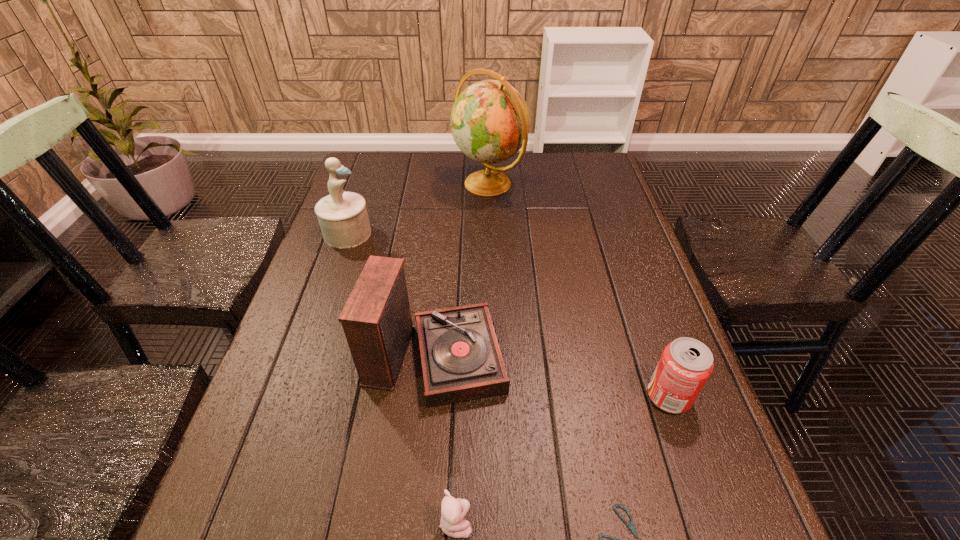
This screenshot has width=960, height=540. What are the coordinates of `vacant area located on the left of the soda can` in the screenshot? It's located at (542, 396).

I want to click on object at the far edge, so click(x=490, y=121).

The width and height of the screenshot is (960, 540). Identify the location of object located at the left edge. coord(343,218).

This screenshot has width=960, height=540. I want to click on object that is at the right edge, so click(x=686, y=364).

I want to click on free space at the far edge of the desktop, so click(562, 187).

This screenshot has height=540, width=960. In order to click on vacant region at the left edge of the desktop in this screenshot , I will do `click(324, 281)`.

This screenshot has height=540, width=960. Identify the location of vacant region at the right edge. (621, 201).

Image resolution: width=960 pixels, height=540 pixels. I want to click on vacant space at the far left corner of the desktop, so click(351, 183).

This screenshot has height=540, width=960. Identify the location of vacant space that's between the globe and the figurine. (419, 208).

At what (x,y) coordinates should I click in order to perform the action: click on the second closest object to the fourth tallest object. Please return your answer as a coordinate pair (x, y). Looking at the image, I should click on (461, 360).